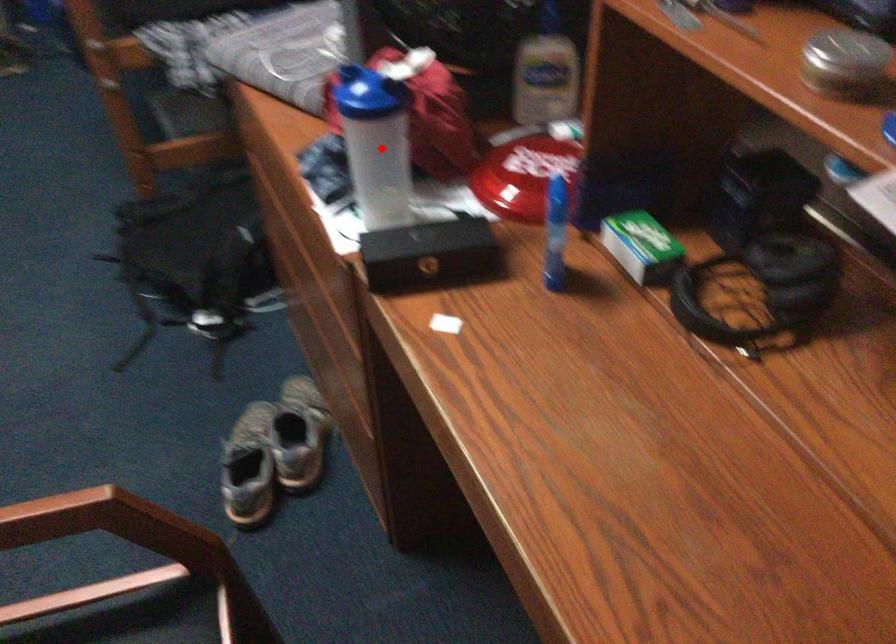
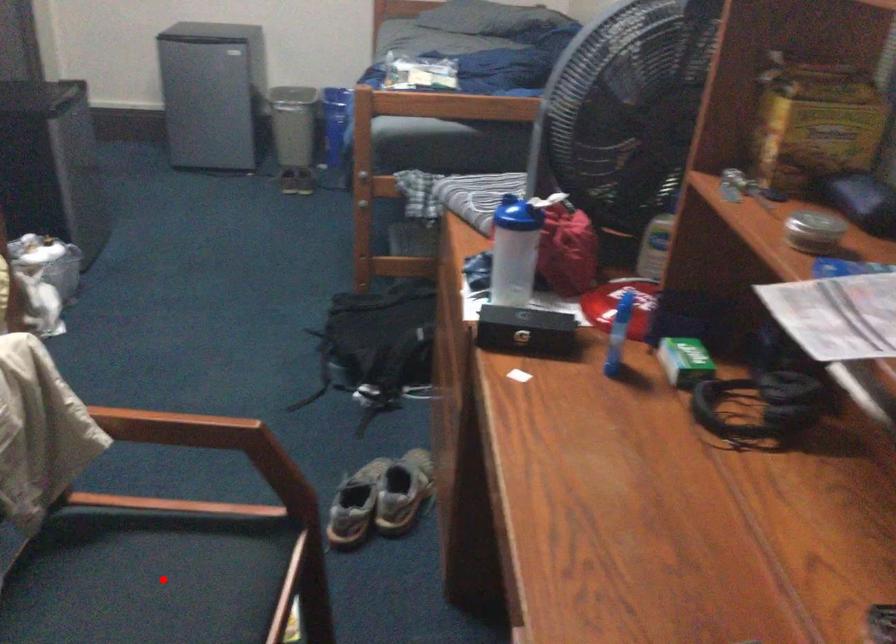
I am providing you with two images of the same scene from different viewpoints. A red point is marked on the first image and another point is marked on the second image. Is the red point in image1 aligned with the point shown in image2?

No